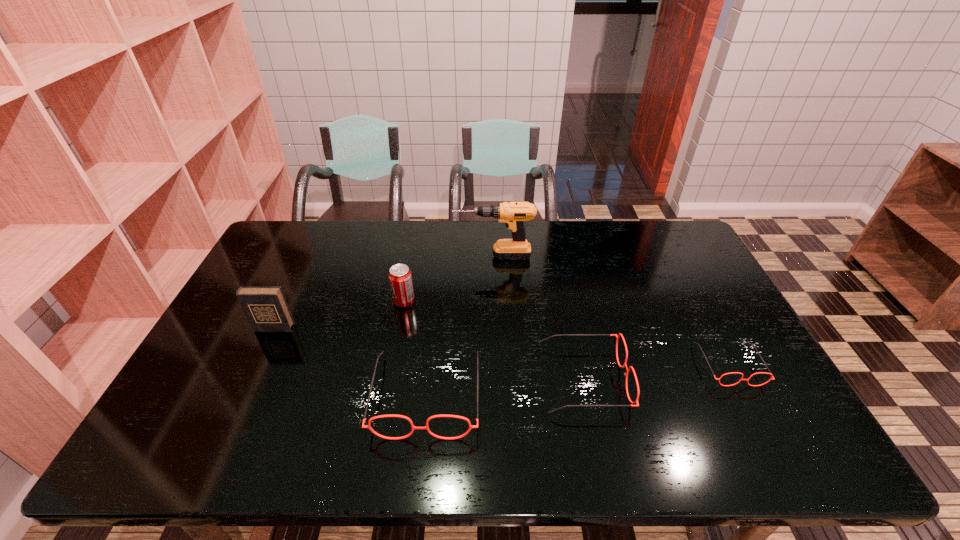
At what (x,y) coordinates should I click in order to perform the action: click on the leftmost object. Please return your answer as a coordinate pair (x, y). Looking at the image, I should click on (266, 308).

The width and height of the screenshot is (960, 540). What are the coordinates of `free space located on the front-facing side of the second spectacles from left to right` in the screenshot? It's located at (762, 379).

Where is `vacant space situated on the front-facing side of the rightmost object`? This screenshot has height=540, width=960. vacant space situated on the front-facing side of the rightmost object is located at coordinates (757, 418).

What are the coordinates of `free space located at the tip of the drill` in the screenshot? It's located at (367, 256).

What are the coordinates of `blank area located at the tip of the drill` in the screenshot? It's located at (436, 256).

Where is `free point located at the tip of the drill`? This screenshot has width=960, height=540. free point located at the tip of the drill is located at coordinates (436, 256).

I want to click on vacant region located on the left of the soda, so click(270, 301).

Locate an element on the screen. free space located 0.200m on the front cover of the leftmost object is located at coordinates (244, 392).

Where is `object positioned at the far edge`? The width and height of the screenshot is (960, 540). object positioned at the far edge is located at coordinates (513, 214).

At what (x,y) coordinates should I click in order to perform the action: click on object located at the left edge. Please return your answer as a coordinate pair (x, y). Looking at the image, I should click on (266, 308).